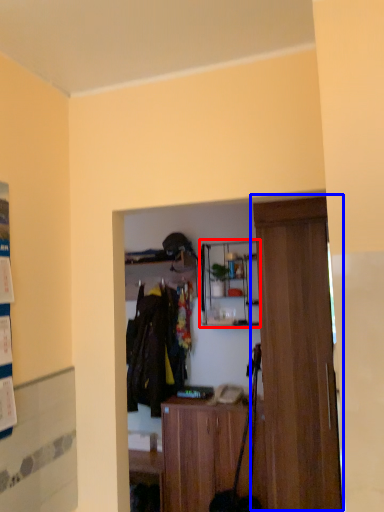
Question: Which of the following is the closest to the observer, shelf (highlighted by a red box) or door (highlighted by a blue box)?

Choices:
 (A) shelf
 (B) door

Answer: (B)